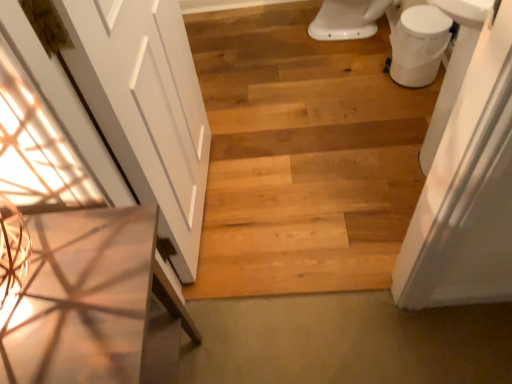
Find the location of `vacant area that lies between white matte door at left and white glossy toilet bowl at upper right`. vacant area that lies between white matte door at left and white glossy toilet bowl at upper right is located at coordinates (304, 148).